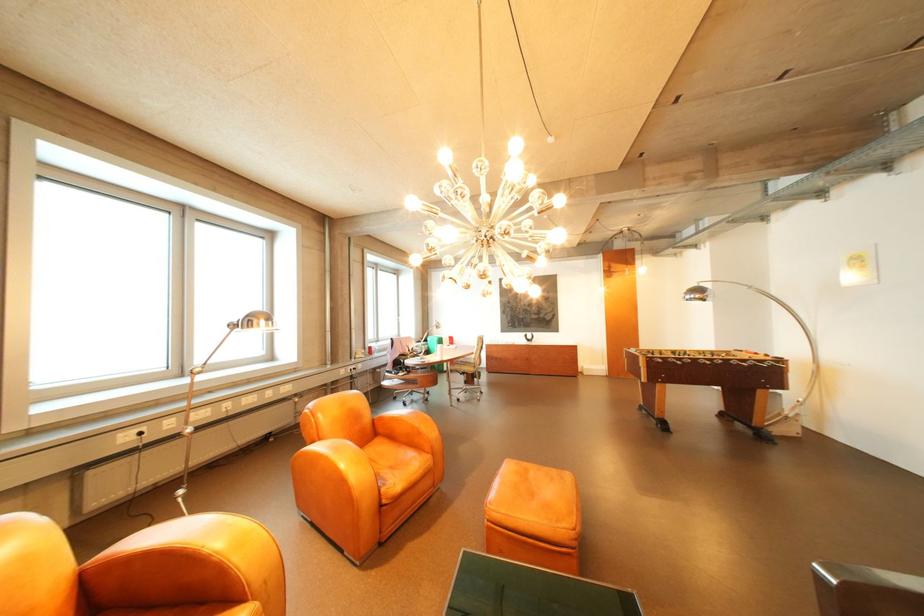
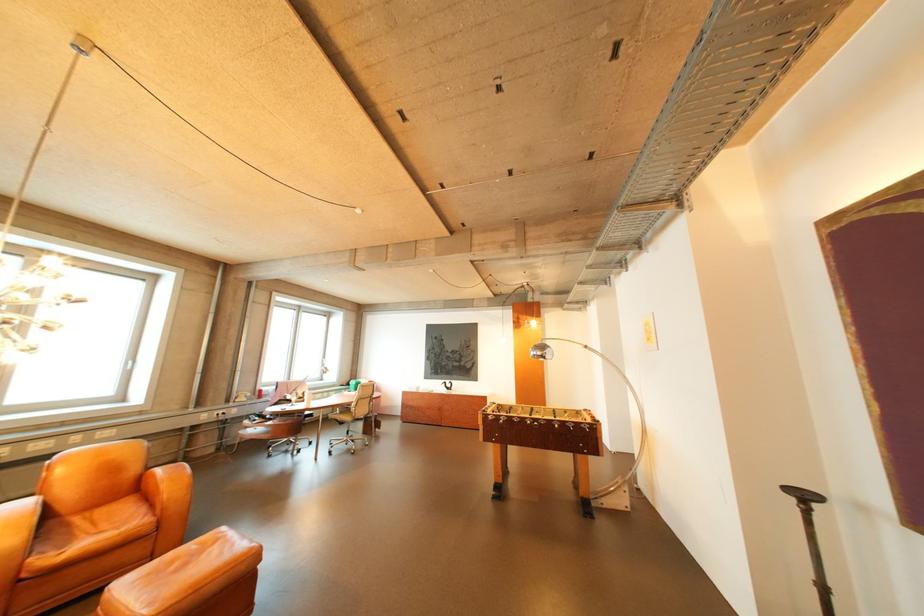
Question: In a continuous first-person perspective shot, in which direction is the camera moving?

Choices:
 (A) Left
 (B) Right
 (C) Forward
 (D) Backward

Answer: (B)